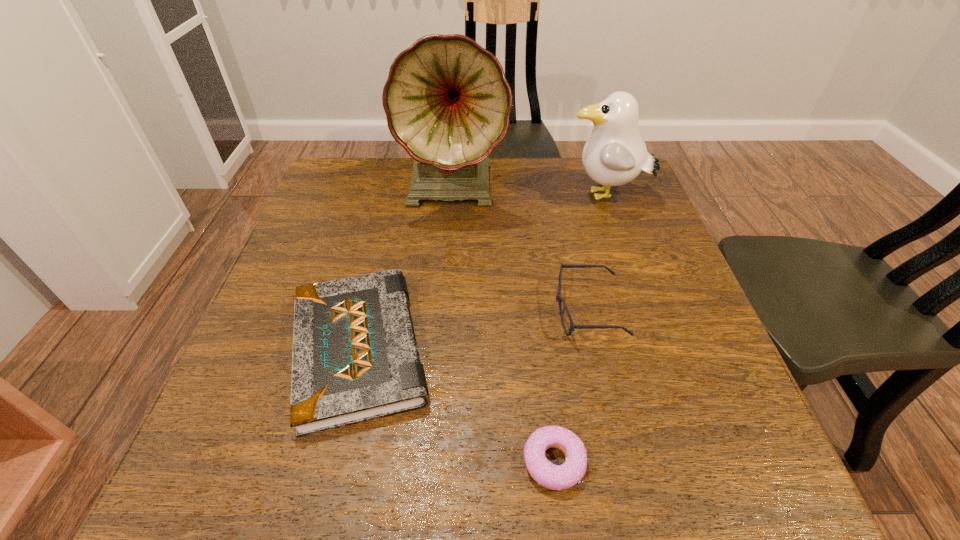
In order to click on record player in this screenshot , I will do `click(447, 101)`.

This screenshot has height=540, width=960. In order to click on gull in this screenshot , I will do `click(615, 154)`.

At what (x,y) coordinates should I click in order to perform the action: click on the third tallest object. Please return your answer as a coordinate pair (x, y). Looking at the image, I should click on (572, 327).

You are a GUI agent. You are given a task and a screenshot of the screen. Output one action in this format:
    pyautogui.click(x=<x>, y=<y>)
    Task: Click on the notebook
    This screenshot has height=540, width=960.
    Given the screenshot: What is the action you would take?
    pyautogui.click(x=355, y=358)

Image resolution: width=960 pixels, height=540 pixels. I want to click on doughnut, so click(556, 477).

You are a GUI agent. You are given a task and a screenshot of the screen. Output one action in this format:
    pyautogui.click(x=<x>, y=<y>)
    Task: Click on the free space located 0.190m from the horn of the tallest object
    
    Given the screenshot: What is the action you would take?
    pyautogui.click(x=448, y=281)

You are a GUI agent. You are given a task and a screenshot of the screen. Output one action in this format:
    pyautogui.click(x=<x>, y=<y>)
    Task: Click on the free spot located on the beak of the fourth shortest object
    This screenshot has width=960, height=540.
    Given the screenshot: What is the action you would take?
    pyautogui.click(x=441, y=197)

Where is `free location located 0.050m on the beak of the fourth shortest object`? free location located 0.050m on the beak of the fourth shortest object is located at coordinates (545, 197).

Where is `vacant space situated on the beak of the fourth shortest object`? vacant space situated on the beak of the fourth shortest object is located at coordinates (474, 197).

Where is `vacant space located 0.260m on the front-facing side of the spectacles`? The height and width of the screenshot is (540, 960). vacant space located 0.260m on the front-facing side of the spectacles is located at coordinates (426, 310).